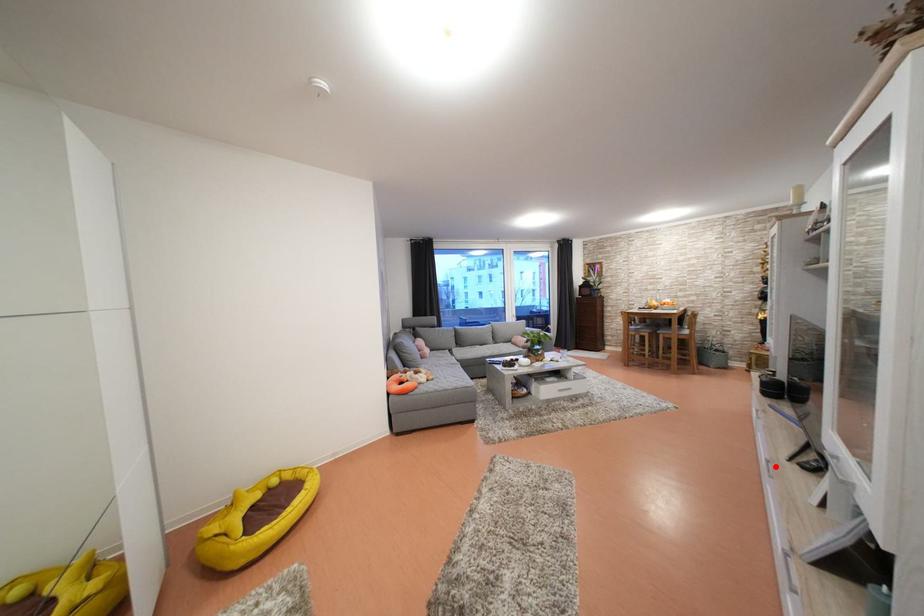
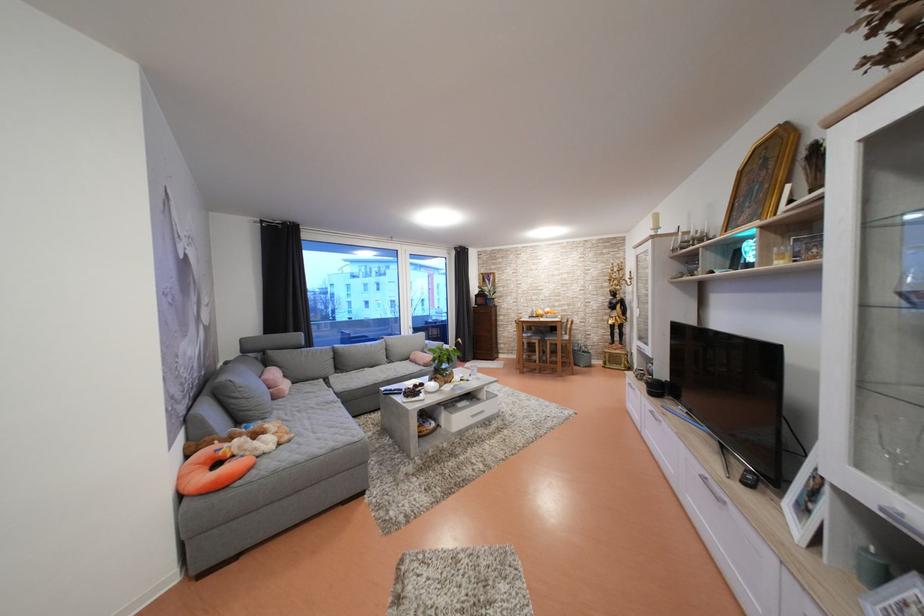
Find the pixel in the second image that matches the highlighted location in the first image.

(711, 484)